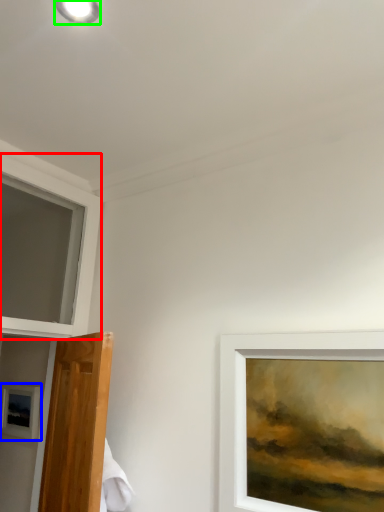
Question: Estimate the real-world distances between objects in this image. Which object is farther from window (highlighted by a red box), picture frame (highlighted by a blue box) or droplight (highlighted by a green box)?

Choices:
 (A) picture frame
 (B) droplight

Answer: (B)